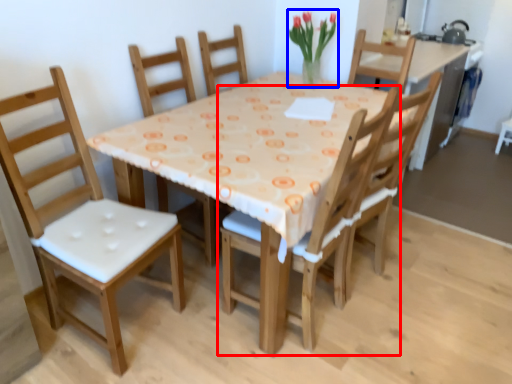
Question: Which of the following is the farthest to the observer, chair (highlighted by a red box) or floral arrangement (highlighted by a blue box)?

Choices:
 (A) chair
 (B) floral arrangement

Answer: (B)